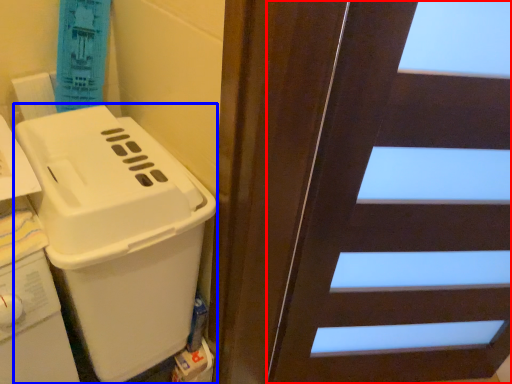
Question: Which point is further to the camera, door (highlighted by a red box) or appliance (highlighted by a blue box)?

Choices:
 (A) door
 (B) appliance

Answer: (B)